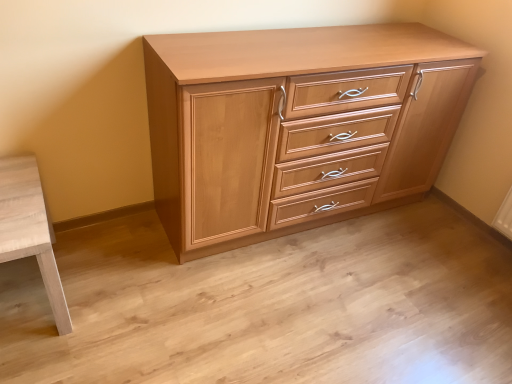
Identify the location of vacant area situated below light wood table at lower left (from a real-world perspective). The image size is (512, 384). (23, 296).